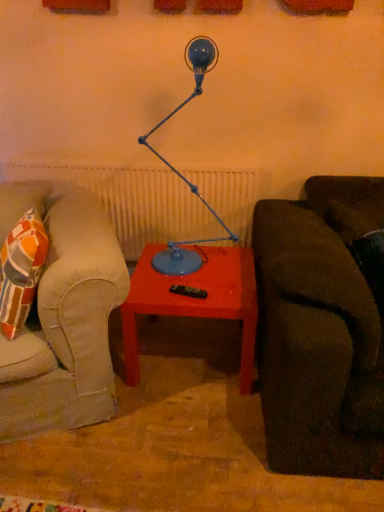
Find the location of a particular element. vacant space in front of blue matte table lamp at center is located at coordinates (185, 296).